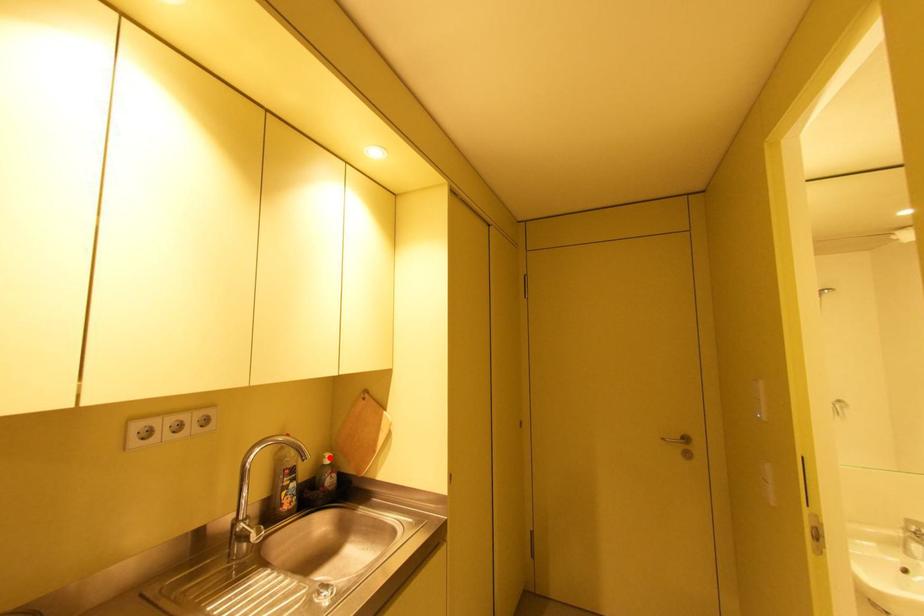
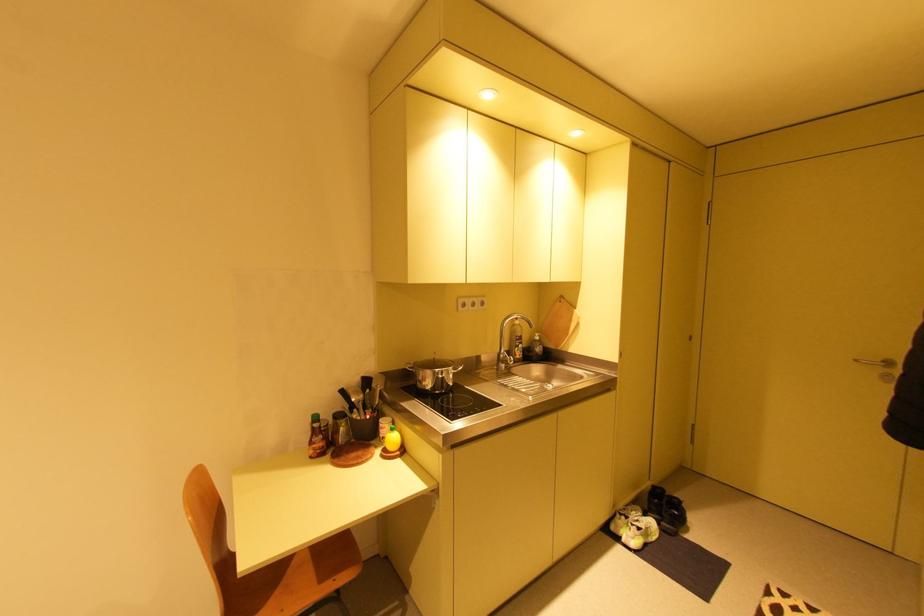
In the second image, find the point that corresponds to the highlighted location in the first image.

(541, 336)